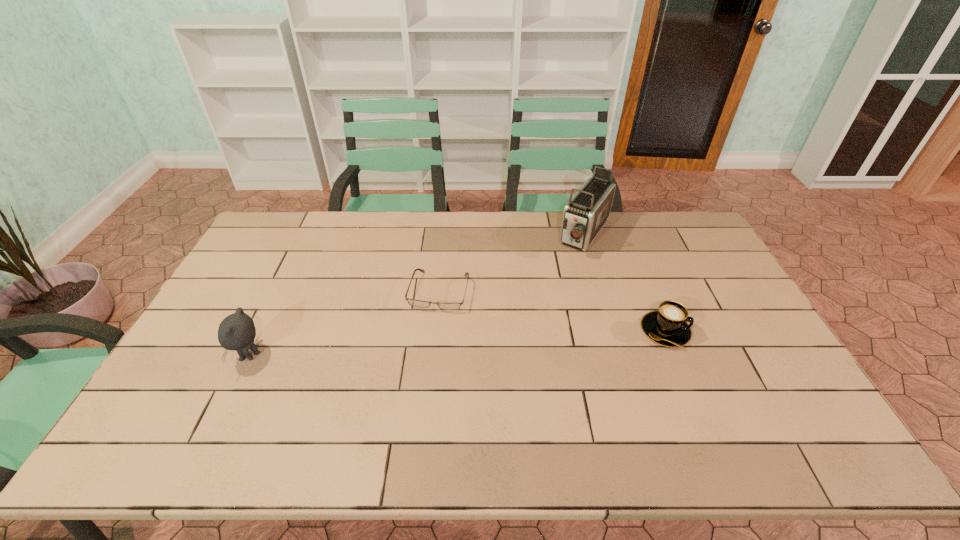
What are the coordinates of `free spot located on the front-facing side of the third object from right to left` in the screenshot? It's located at (421, 355).

The width and height of the screenshot is (960, 540). What are the coordinates of `free point located 0.050m on the front-facing side of the third object from right to left` in the screenshot? It's located at (430, 326).

Identify the location of free space located at the lens of the tallest object. The width and height of the screenshot is (960, 540). (557, 284).

Locate an element on the screen. vacant area located 0.290m at the lens of the tallest object is located at coordinates (x=540, y=308).

Where is `vacant space located at the lens of the tallest object`? The width and height of the screenshot is (960, 540). vacant space located at the lens of the tallest object is located at coordinates (547, 296).

This screenshot has width=960, height=540. I want to click on object present at the far edge, so click(585, 214).

At what (x,y) coordinates should I click in order to perform the action: click on object that is positioned at the left edge. Please return your answer as a coordinate pair (x, y). This screenshot has height=540, width=960. Looking at the image, I should click on (237, 331).

Image resolution: width=960 pixels, height=540 pixels. Find the location of `vacant area at the far edge of the desktop`. vacant area at the far edge of the desktop is located at coordinates tap(405, 229).

In the image, there is a desktop. Where is `vacant space at the near edge`? This screenshot has width=960, height=540. vacant space at the near edge is located at coordinates (264, 398).

This screenshot has height=540, width=960. Find the location of `vacant space at the left edge of the desktop`. vacant space at the left edge of the desktop is located at coordinates (258, 253).